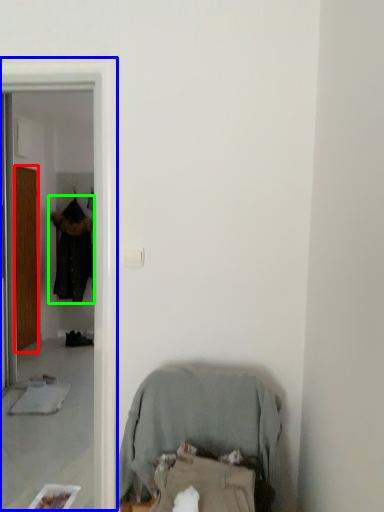
Question: Considering the real-world distances, which object is closest to door (highlighted by a red box)? screen door (highlighted by a blue box) or clothing (highlighted by a green box).

Choices:
 (A) screen door
 (B) clothing

Answer: (B)